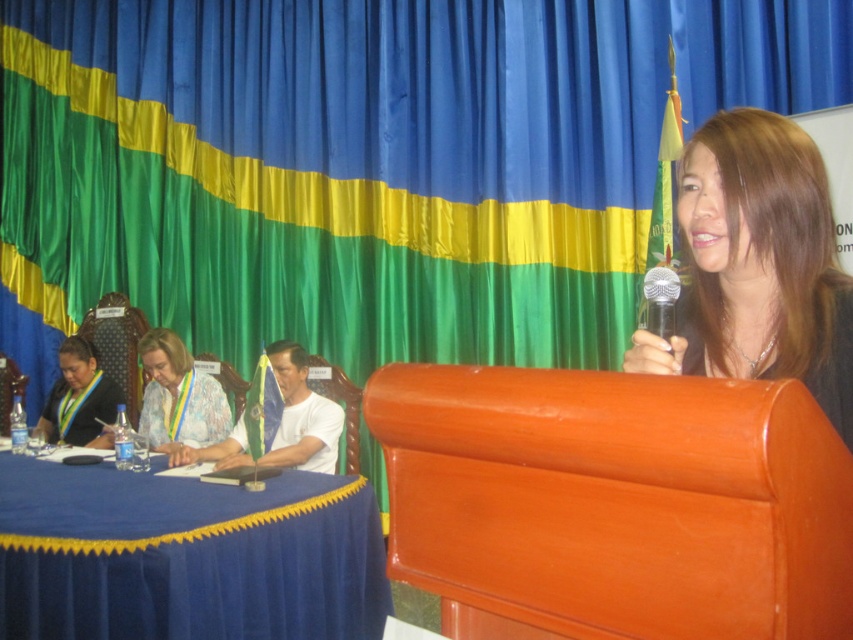
You are a photographer at the event and need to adjust your camera focus. Which object, the brown hair at upper right or the white matte shirt at center, is closer to the camera lens?

The brown hair at upper right is closer to the camera lens because it is not as tall as the white matte shirt at center, indicating it is positioned in front.

You are a photographer at the event and need to capture a photo where the blue fabric table at lower left is visible without being blocked by the brown hair at upper right. Based on their positions, is this possible?

The blue fabric table at lower left is positioned under the brown hair at upper right, so the brown hair at upper right is above it. Therefore, the brown hair at upper right might block the view of the blue fabric table at lower left. To ensure the table is visible, you should adjust the camera angle to look downward or move the camera position to avoid the hair blocking the table.

You are organizing a conference and need to place a name tag for a speaker. The blue fabric table at lower left and the brown hair at upper right are visible from the podium. Which object is located to the left of the other?

The blue fabric table at lower left is positioned on the left side of brown hair at upper right, so the blue fabric table at lower left is to the left of the brown hair at upper right.